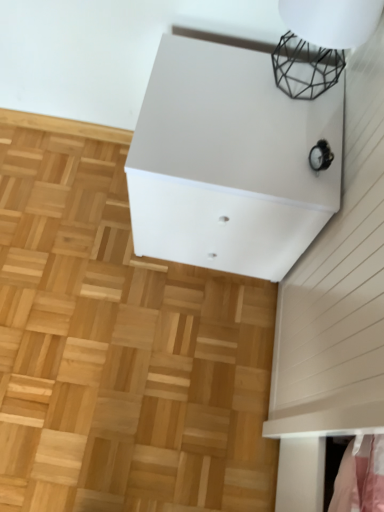
Question: Does white matte cabinet at upper center have a greater height compared to black wire mesh at upper right?

Choices:
 (A) no
 (B) yes

Answer: (B)

Question: Does white matte cabinet at upper center have a greater width compared to black wire mesh at upper right?

Choices:
 (A) yes
 (B) no

Answer: (A)

Question: Could you tell me if white matte cabinet at upper center is turned towards black wire mesh at upper right?

Choices:
 (A) no
 (B) yes

Answer: (A)

Question: Is white matte cabinet at upper center outside of black wire mesh at upper right?

Choices:
 (A) no
 (B) yes

Answer: (B)

Question: Considering the relative positions of white matte cabinet at upper center and black wire mesh at upper right in the image provided, is white matte cabinet at upper center to the left of black wire mesh at upper right from the viewer's perspective?

Choices:
 (A) yes
 (B) no

Answer: (A)

Question: From their relative heights in the image, would you say black wire mesh at upper right is taller or shorter than natural wood parquet floor at center?

Choices:
 (A) short
 (B) tall

Answer: (B)

Question: Is black wire mesh at upper right in front of or behind natural wood parquet floor at center in the image?

Choices:
 (A) behind
 (B) front

Answer: (B)

Question: From a real-world perspective, is black wire mesh at upper right physically located above or below natural wood parquet floor at center?

Choices:
 (A) below
 (B) above

Answer: (B)

Question: Considering the positions of point click(x=372, y=4) and point click(x=87, y=138), is point click(x=372, y=4) closer or farther from the camera than point click(x=87, y=138)?

Choices:
 (A) closer
 (B) farther

Answer: (A)

Question: Is natural wood parquet floor at center in front of or behind white matte cabinet at upper center in the image?

Choices:
 (A) behind
 (B) front

Answer: (A)

Question: Considering the relative positions of natural wood parquet floor at center and white matte cabinet at upper center in the image provided, is natural wood parquet floor at center to the left or to the right of white matte cabinet at upper center?

Choices:
 (A) right
 (B) left

Answer: (B)

Question: Looking at the image, does natural wood parquet floor at center seem bigger or smaller compared to white matte cabinet at upper center?

Choices:
 (A) small
 (B) big

Answer: (A)

Question: Considering the positions of natural wood parquet floor at center and white matte cabinet at upper center in the image, is natural wood parquet floor at center taller or shorter than white matte cabinet at upper center?

Choices:
 (A) tall
 (B) short

Answer: (B)

Question: From their relative heights in the image, would you say white matte cabinet at upper center is taller or shorter than natural wood parquet floor at center?

Choices:
 (A) short
 (B) tall

Answer: (B)

Question: From the image's perspective, is white matte cabinet at upper center positioned above or below natural wood parquet floor at center?

Choices:
 (A) below
 (B) above

Answer: (B)